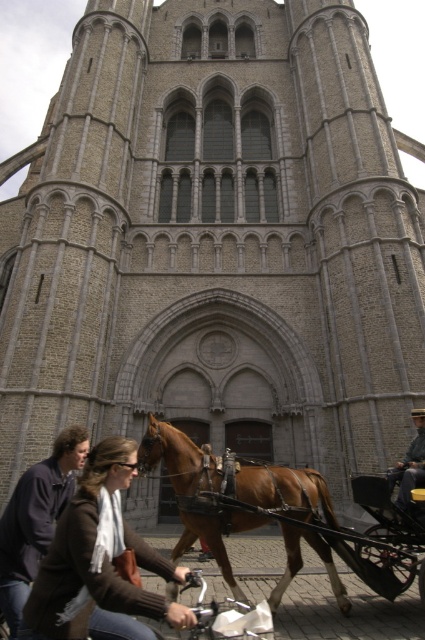
Between dark blue jacket at lower left and dark gray fabric coat at lower right, which one appears on the left side from the viewer's perspective?

Positioned to the left is dark blue jacket at lower left.

Does dark blue jacket at lower left have a larger size compared to dark gray fabric coat at lower right?

Correct, dark blue jacket at lower left is larger in size than dark gray fabric coat at lower right.

Locate an element on the screen. dark blue jacket at lower left is located at coordinates (36, 518).

Is brown leather jacket at lower left shorter than brown glossy horse at center?

Correct, brown leather jacket at lower left is not as tall as brown glossy horse at center.

How much distance is there between brown leather jacket at lower left and brown glossy horse at center?

brown leather jacket at lower left is 8.54 meters away from brown glossy horse at center.

The width and height of the screenshot is (425, 640). Describe the element at coordinates (98, 557) in the screenshot. I see `brown leather jacket at lower left` at that location.

Find the location of a particular element. Image resolution: width=425 pixels, height=640 pixels. brown leather jacket at lower left is located at coordinates (98, 557).

Looking at this image, how distant is brown leather jacket at lower left from wooden cart at lower right?

brown leather jacket at lower left and wooden cart at lower right are 16.40 meters apart from each other.

Locate an element on the screen. brown leather jacket at lower left is located at coordinates (98, 557).

Describe the element at coordinates (98, 557) in the screenshot. I see `brown leather jacket at lower left` at that location.

I want to click on brown leather jacket at lower left, so click(x=98, y=557).